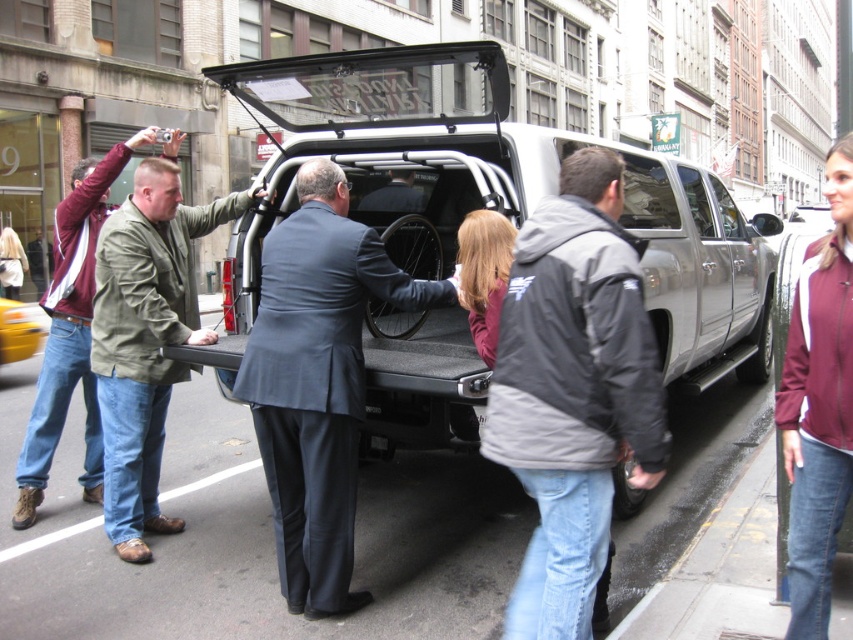
Can you confirm if white matte truck bed at center is smaller than green canvas jacket at left?

Yes.

Does white matte truck bed at center appear over green canvas jacket at left?

Yes.

The image size is (853, 640). I want to click on white matte truck bed at center, so click(498, 189).

Between point (405, 163) and point (61, 216), which one is positioned in front?

Point (405, 163) is in front.

Does white matte truck bed at center have a lesser height compared to green matte jacket at left?

Incorrect, white matte truck bed at center's height does not fall short of green matte jacket at left's.

Locate an element on the screen. white matte truck bed at center is located at coordinates (498, 189).

Is white matte truck bed at center to the right of gray fleece jacket at center from the viewer's perspective?

Incorrect, white matte truck bed at center is not on the right side of gray fleece jacket at center.

Between white matte truck bed at center and gray fleece jacket at center, which one is positioned lower?

gray fleece jacket at center

The image size is (853, 640). Identify the location of white matte truck bed at center. (498, 189).